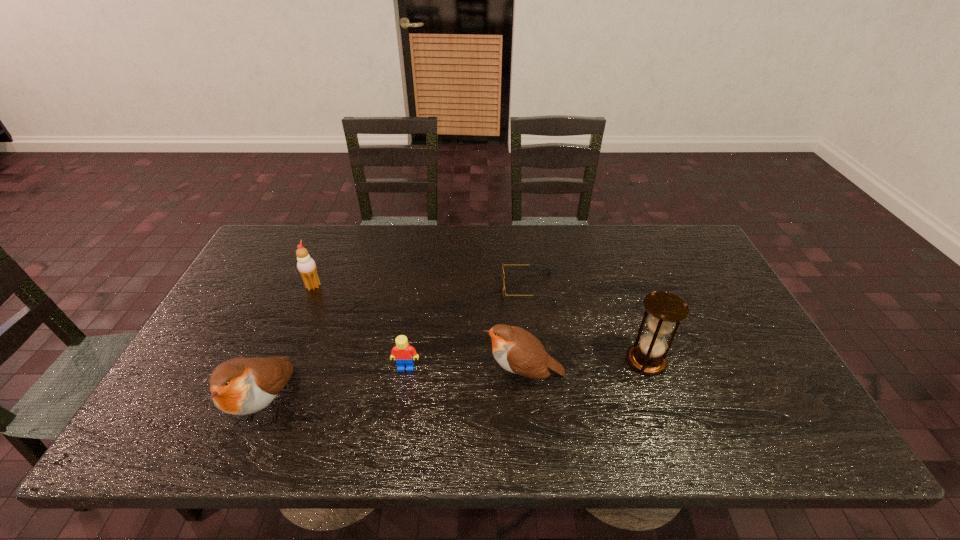
Identify which object is the second closest to the icecream. Please provide its 2D coordinates. Your answer should be formatted as a tuple, i.e. [(x, y)], where the tuple contains the x and y coordinates of a point satisfying the conditions above.

[(404, 354)]

I want to click on blank space that satisfies the following two spatial constraints: 1. on the front-facing side of the sunglasses; 2. on the left side of the hourglass, so click(x=538, y=361).

You are a GUI agent. You are given a task and a screenshot of the screen. Output one action in this format:
    pyautogui.click(x=<x>, y=<y>)
    Task: Click on the free space that satisfies the following two spatial constraints: 1. on the back side of the rightmost object; 2. on the front-facing side of the shortest object
    This screenshot has width=960, height=540.
    Given the screenshot: What is the action you would take?
    pyautogui.click(x=619, y=286)

Locate an element on the screen. free space that satisfies the following two spatial constraints: 1. on the front-facing side of the rightmost object; 2. on the left side of the shortest object is located at coordinates (538, 361).